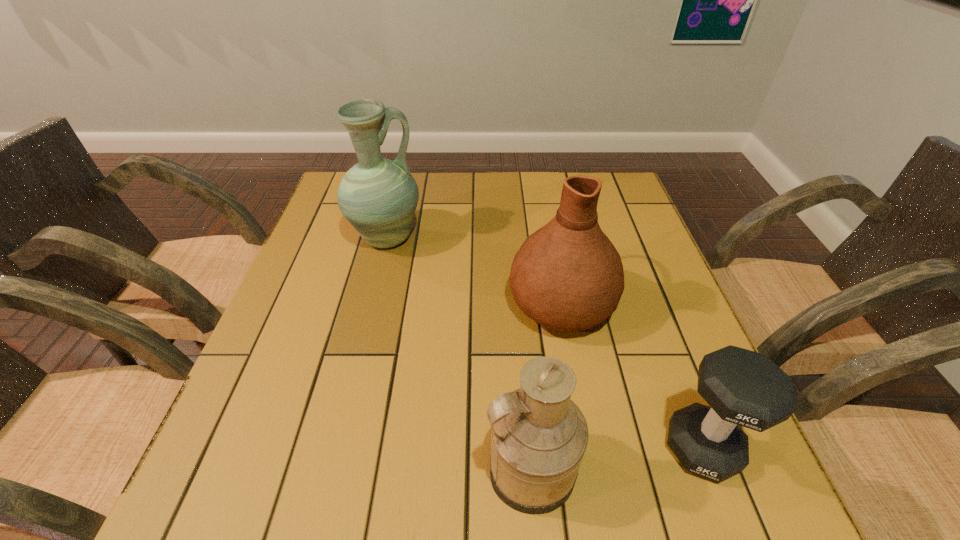
Identify the location of vacant space at the near edge of the desktop. (396, 480).

At what (x,y) coordinates should I click in order to perform the action: click on vacant position at the left edge of the desktop. Please return your answer as a coordinate pair (x, y). Looking at the image, I should click on click(313, 362).

Where is `free region at the right edge of the desktop`? free region at the right edge of the desktop is located at coordinates (645, 368).

Identify the location of vacant region at the far right corner of the desktop. (608, 208).

Where is `vacant region between the second farthest object and the rightmost object`? vacant region between the second farthest object and the rightmost object is located at coordinates (632, 375).

At what (x,y) coordinates should I click in order to perform the action: click on unoccupied area between the shortest object and the second farthest object. Please return your answer as a coordinate pair (x, y). Looking at the image, I should click on (632, 375).

You are a GUI agent. You are given a task and a screenshot of the screen. Output one action in this format:
    pyautogui.click(x=<x>, y=<y>)
    Task: Click on the free space that is in between the nearest pitcher and the farthest object
    
    Given the screenshot: What is the action you would take?
    point(458,354)

Find the location of a particular element. The image size is (960, 540). free space that is in between the leftmost object and the dumbbell is located at coordinates (544, 343).

At what (x,y) coordinates should I click in order to perform the action: click on free space between the rightmost object and the second farthest pitcher. Please return your answer as a coordinate pair (x, y). This screenshot has width=960, height=540. Looking at the image, I should click on (632, 375).

The image size is (960, 540). What are the coordinates of `vacant space that's between the second farthest pitcher and the farthest object` in the screenshot? It's located at 473,271.